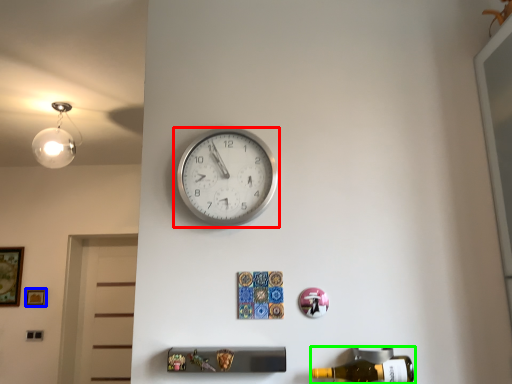
Question: Estimate the real-world distances between objects in this image. Which object is farther from wall clock (highlighted by a red box), picture frame (highlighted by a blue box) or beer bottle (highlighted by a green box)?

Choices:
 (A) picture frame
 (B) beer bottle

Answer: (A)